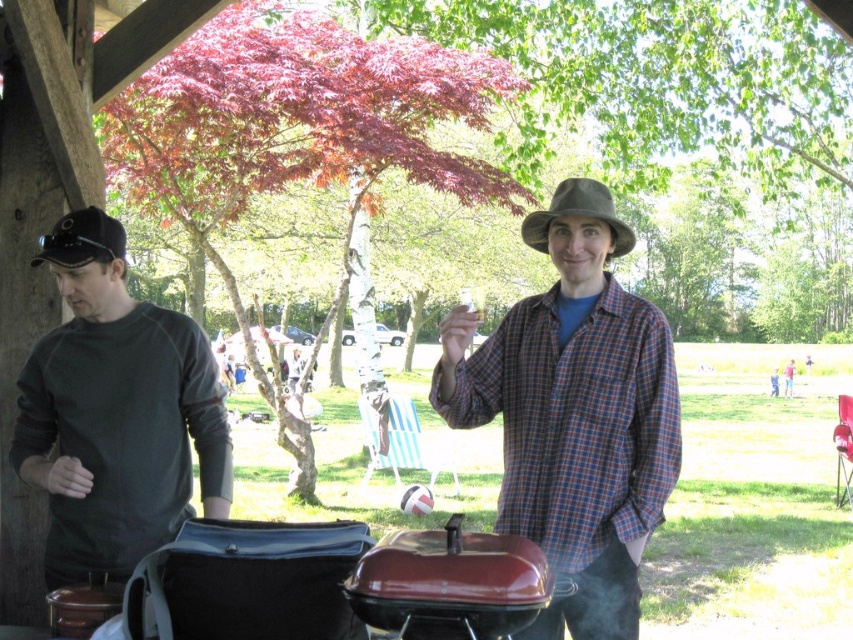
Is plaid fabric shirt at center smaller than dark gray long-sleeve shirt at left?

Yes, plaid fabric shirt at center is smaller than dark gray long-sleeve shirt at left.

Does plaid fabric shirt at center have a greater width compared to dark gray long-sleeve shirt at left?

In fact, plaid fabric shirt at center might be narrower than dark gray long-sleeve shirt at left.

Between point (497, 394) and point (83, 476), which one is positioned in front?

Positioned in front is point (83, 476).

Locate an element on the screen. plaid fabric shirt at center is located at coordinates (573, 413).

Does dark gray long-sleeve shirt at left appear under black matte fedora at left?

Yes, dark gray long-sleeve shirt at left is below black matte fedora at left.

Is dark gray long-sleeve shirt at left taller than black matte fedora at left?

Indeed, dark gray long-sleeve shirt at left has a greater height compared to black matte fedora at left.

Does point (86, 282) come in front of point (106, 214)?

Yes.

Locate an element on the screen. Image resolution: width=853 pixels, height=640 pixels. dark gray long-sleeve shirt at left is located at coordinates (115, 412).

From the picture: Does dark gray long-sleeve shirt at left have a smaller size compared to brown felt fedora at center?

No.

Consider the image. Which is more to the right, dark gray long-sleeve shirt at left or brown felt fedora at center?

From the viewer's perspective, brown felt fedora at center appears more on the right side.

Between point (137, 371) and point (634, 236), which one is positioned in front?

Point (137, 371)

Find the location of a particular element. The height and width of the screenshot is (640, 853). dark gray long-sleeve shirt at left is located at coordinates (115, 412).